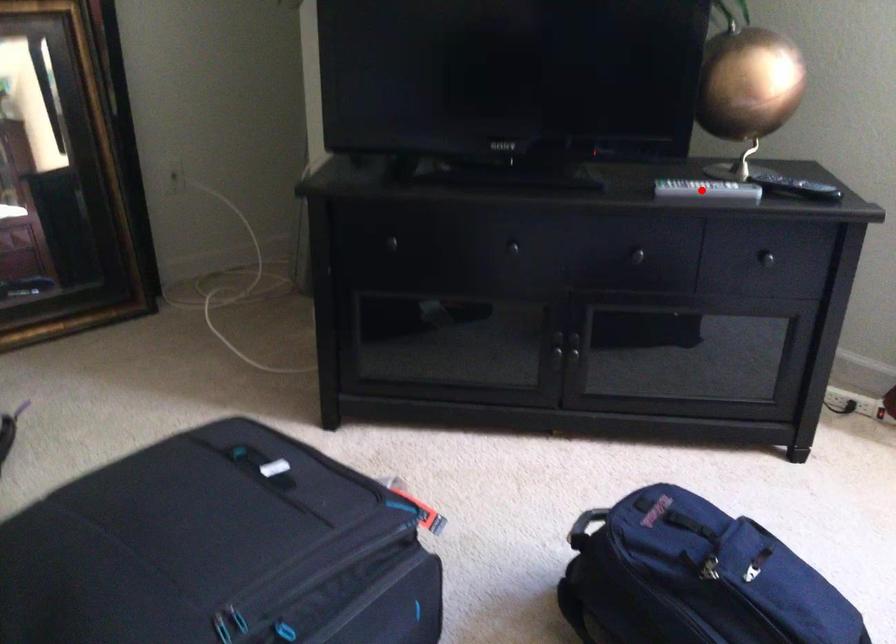
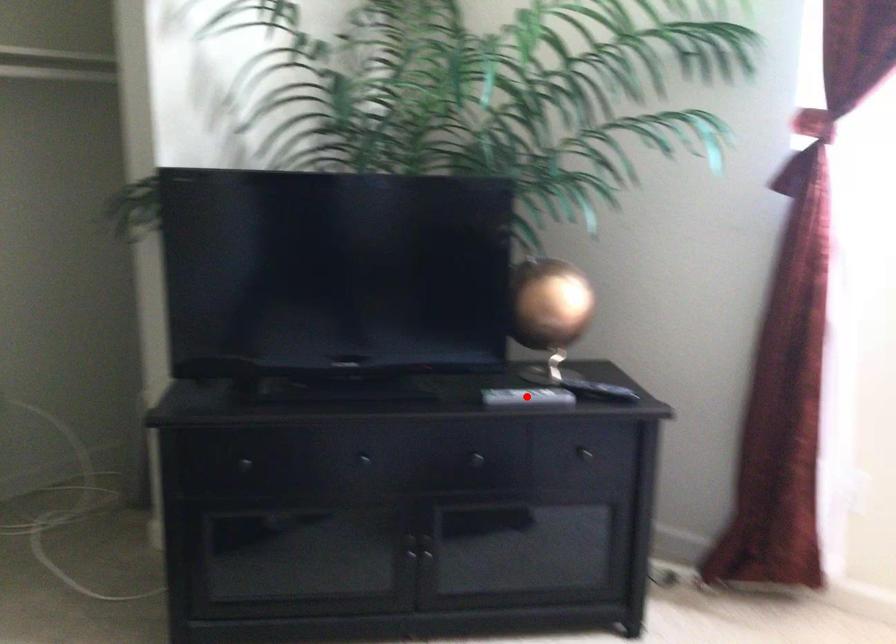
I am providing you with two images of the same scene from different viewpoints. A red point is marked on the first image and another point is marked on the second image. Is the marked point in image1 the same physical position as the marked point in image2?

Yes